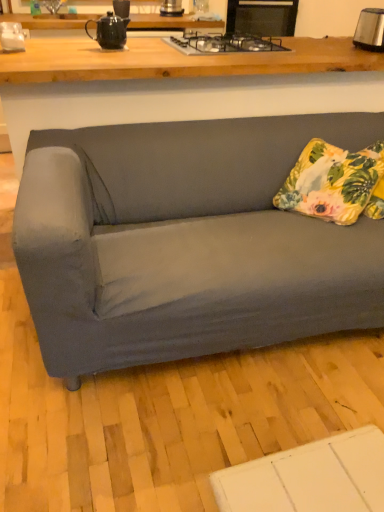
The image size is (384, 512). Identify the location of free space in front of matte black teapot at upper center. (100, 52).